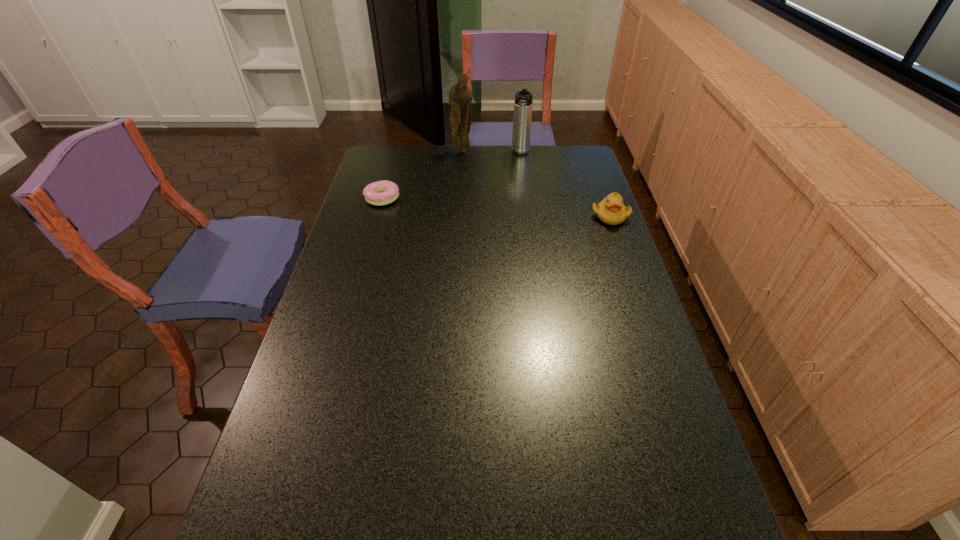
Where is `free region at the far edge`? free region at the far edge is located at coordinates (494, 149).

In the image, there is a desktop. At what (x,y) coordinates should I click in order to perform the action: click on vacant space at the near edge. Please return your answer as a coordinate pair (x, y). The image size is (960, 540). Looking at the image, I should click on (338, 481).

The image size is (960, 540). Find the location of `free point at the left edge`. free point at the left edge is located at coordinates (289, 385).

In the image, there is a desktop. Identify the location of free region at the right edge. This screenshot has width=960, height=540. (623, 328).

Identify the location of free space at the near left corner of the desktop. (262, 491).

Locate an element on the screen. This screenshot has width=960, height=540. free spot between the third object from left to right and the duckling is located at coordinates (565, 185).

Where is `free space that is in between the second object from right to left and the tallest object`? The width and height of the screenshot is (960, 540). free space that is in between the second object from right to left and the tallest object is located at coordinates (492, 152).

The width and height of the screenshot is (960, 540). In order to click on free space between the leftmost object and the duckling in this screenshot , I will do `click(496, 207)`.

The height and width of the screenshot is (540, 960). What are the coordinates of `empty space between the tallest object and the third object from left to right` in the screenshot? It's located at (492, 152).

Image resolution: width=960 pixels, height=540 pixels. In order to click on free point between the doughnut and the third object from left to right in this screenshot , I will do `click(451, 176)`.